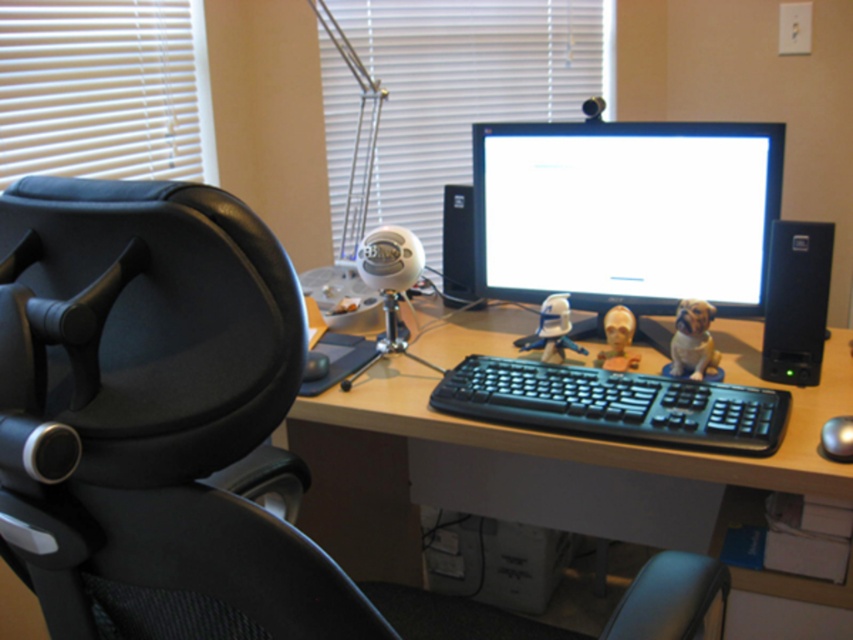
What do you see at coordinates (442, 96) in the screenshot? I see `white matte blinds at upper center` at bounding box center [442, 96].

Between point (444, 154) and point (845, 451), which one is positioned in front?

Point (845, 451)

Which is in front, point (383, 33) or point (828, 444)?

Point (828, 444) is in front.

Identify the location of white matte blinds at upper center. The width and height of the screenshot is (853, 640). [442, 96].

Between black mesh swivel chair at left and white matte figurine at center, which one has less height?

white matte figurine at center is shorter.

Who is positioned more to the right, black mesh swivel chair at left or white matte figurine at center?

white matte figurine at center is more to the right.

At what (x,y) coordinates should I click in order to perform the action: click on black mesh swivel chair at left. Please return your answer as a coordinate pair (x, y). The image size is (853, 640). Looking at the image, I should click on (152, 417).

You are a GUI agent. You are given a task and a screenshot of the screen. Output one action in this format:
    pyautogui.click(x=<x>, y=<y>)
    Task: Click on the fuzzy beige dog at center right
    The image size is (853, 640).
    Given the screenshot: What is the action you would take?
    pyautogui.click(x=693, y=340)

Is point (672, 339) farther from viewer compared to point (842, 428)?

Yes, it is behind point (842, 428).

Does point (674, 321) come behind point (820, 440)?

Yes, it is.

Identify the location of fuzzy beige dog at center right. (693, 340).